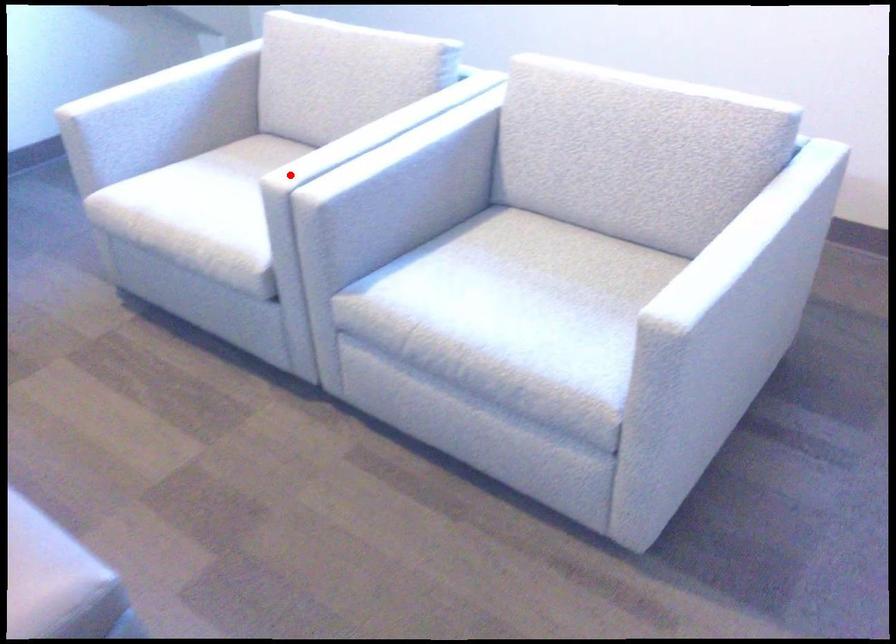
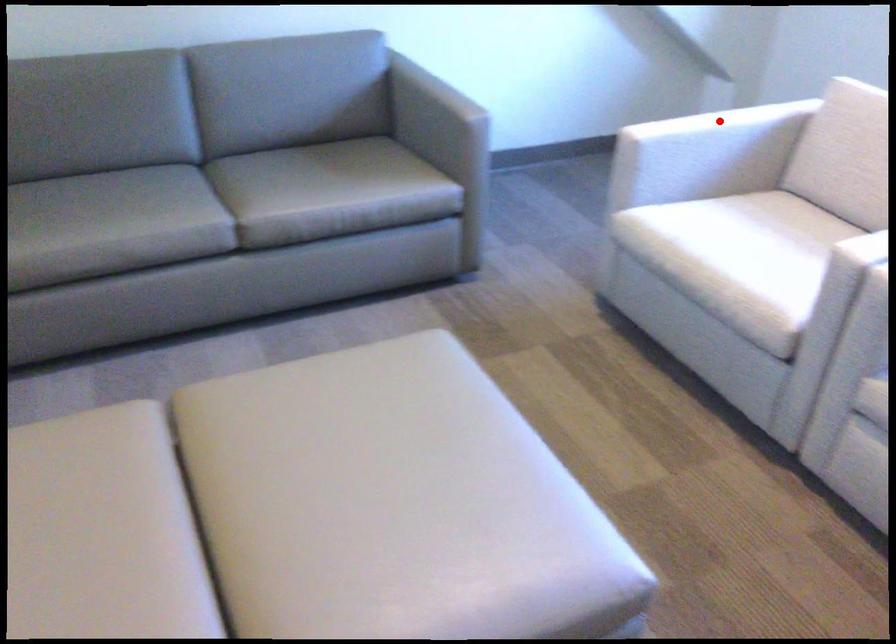
I am providing you with two images of the same scene from different viewpoints. A red point is marked on the first image and another point is marked on the second image. Is the marked point in image1 the same physical position as the marked point in image2?

No